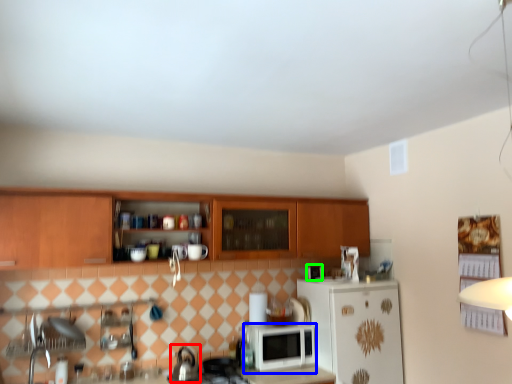
Question: Which is nearer to the tea pot (highlighted by a red box)? microwave oven (highlighted by a blue box) or appliance (highlighted by a green box).

Choices:
 (A) microwave oven
 (B) appliance

Answer: (A)